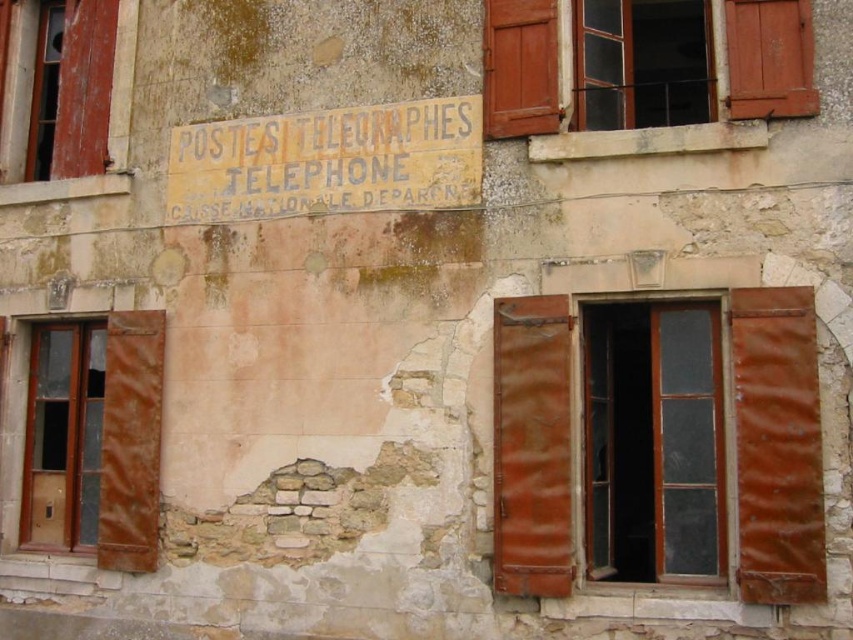
Question: Does rusty metal shutter at center have a greater width compared to matte wooden window at left?

Choices:
 (A) no
 (B) yes

Answer: (A)

Question: Is rusty metal shutter at right positioned behind brown wooden window at left?

Choices:
 (A) no
 (B) yes

Answer: (A)

Question: Which of the following is the farthest from the observer?

Choices:
 (A) (798, 550)
 (B) (502, 378)
 (C) (123, 92)

Answer: (C)

Question: Which object appears farthest from the camera in this image?

Choices:
 (A) matte wooden window at left
 (B) yellow faded paper sign at upper center

Answer: (A)

Question: Which object is the farthest from the yellow faded paper sign at upper center?

Choices:
 (A) brown wooden window at left
 (B) transparent glass window at center
 (C) rustic wooden window at upper center
 (D) rusty metal shutter at center

Answer: (B)

Question: In this image, where is rusty wood window at center right located relative to brown wooden window at left?

Choices:
 (A) right
 (B) left

Answer: (A)